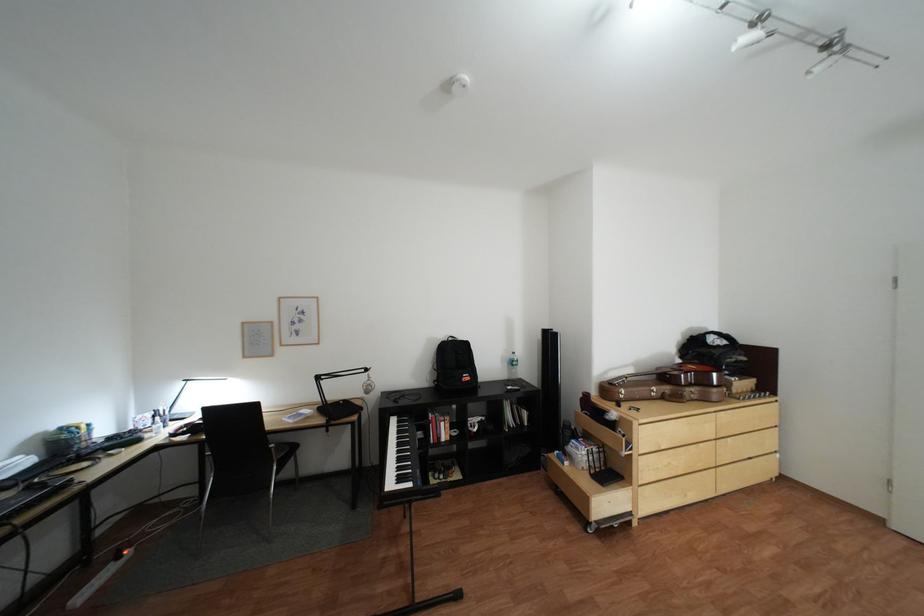
At what (x,y) coordinates should I click in order to perform the action: click on brown guitar case. Please return your answer as a coordinate pair (x, y). This screenshot has height=616, width=924. Looking at the image, I should click on (667, 384).